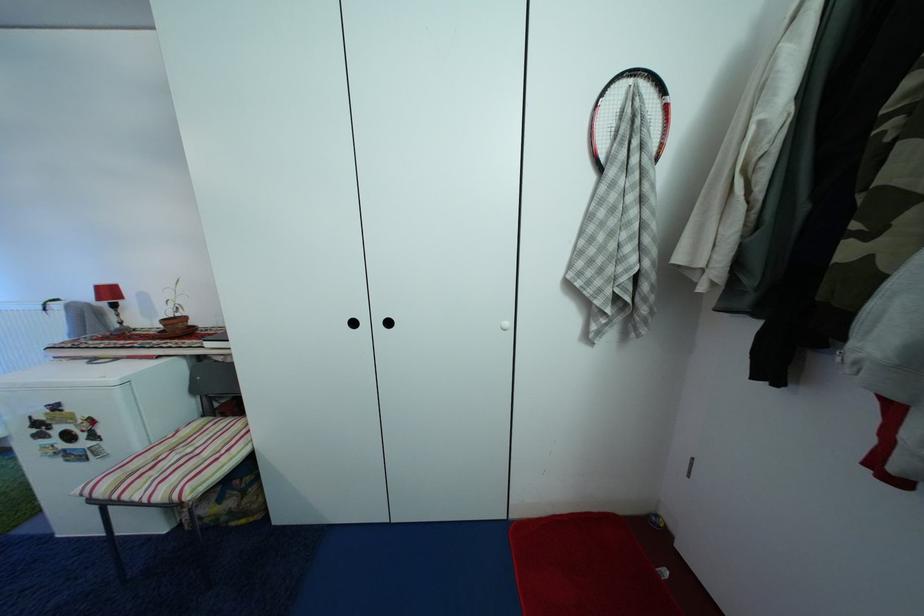
Where would you lift the red table lamp? Please return your answer as a coordinate pair (x, y).

(111, 301)